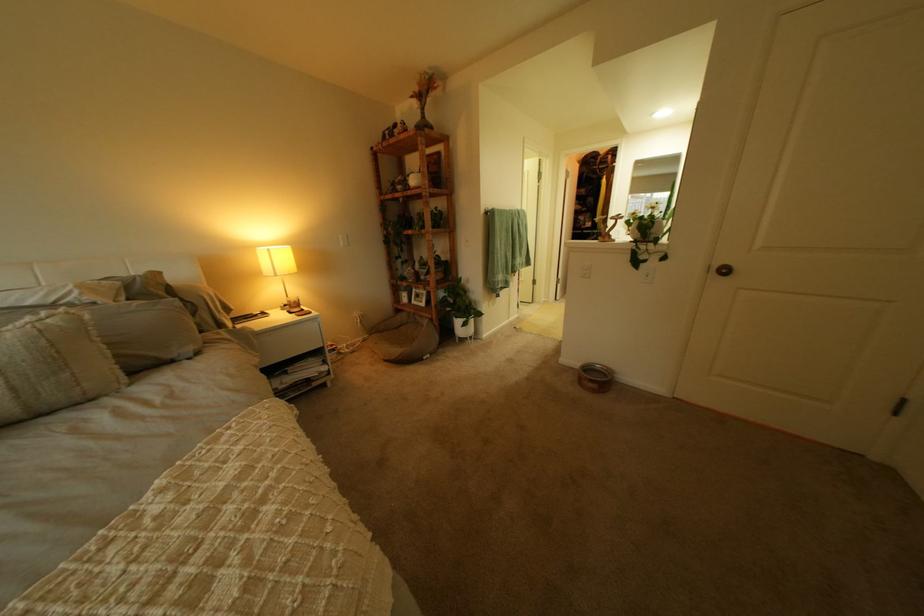
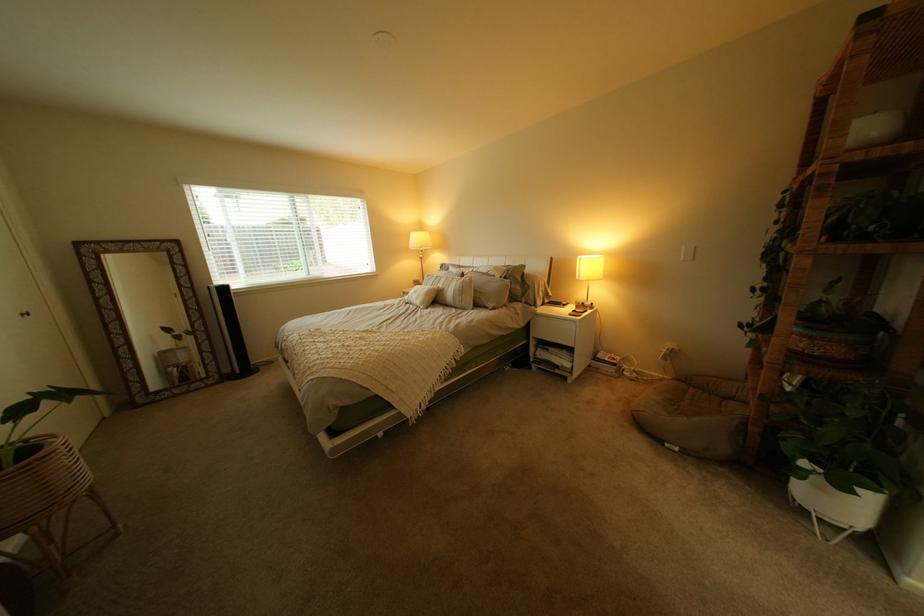
Locate, in the second image, the point that corresponds to the point at 453,282 in the first image.

(805, 354)